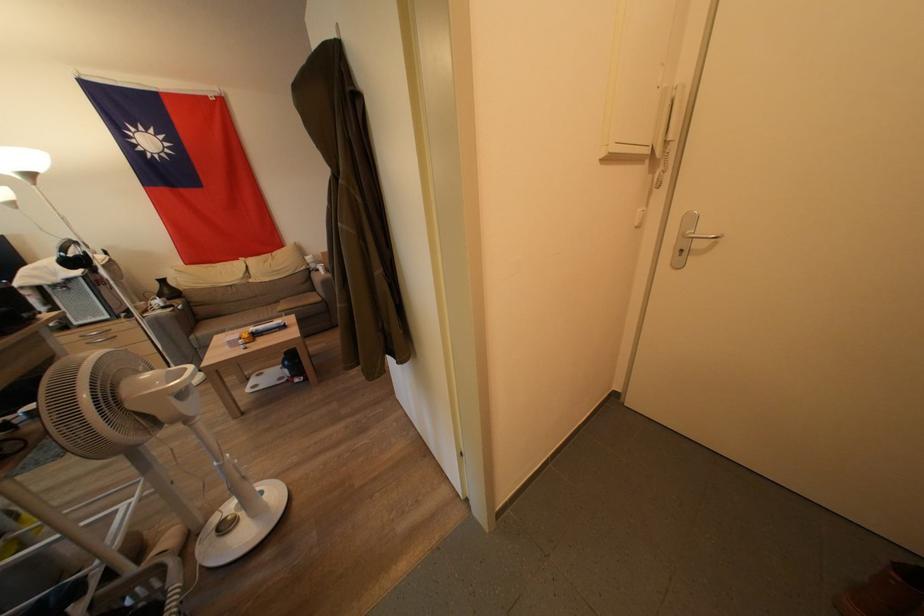
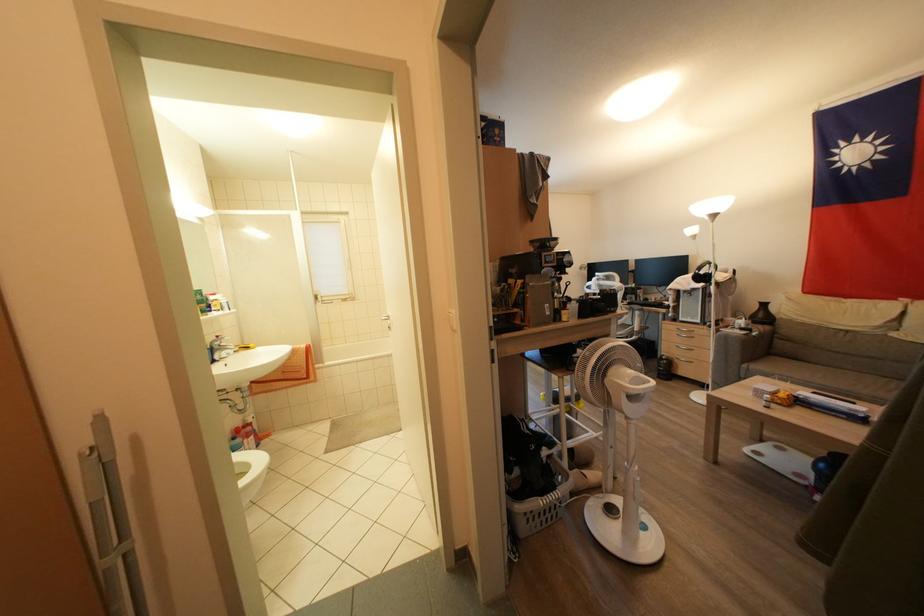
Where in the second image is the point corresponding to [169,312] from the first image?

(747, 333)